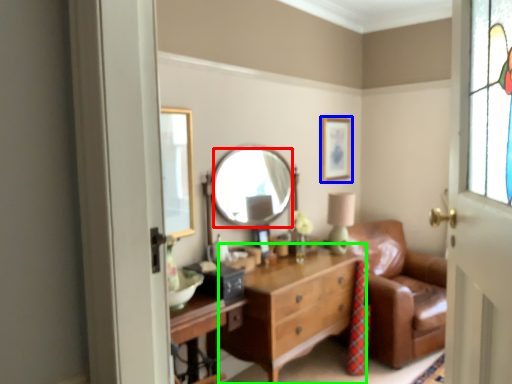
Question: Which object is positioned farthest from mirror (highlighted by a red box)? Select from picture frame (highlighted by a blue box) and chest of drawers (highlighted by a green box).

Choices:
 (A) picture frame
 (B) chest of drawers

Answer: (A)